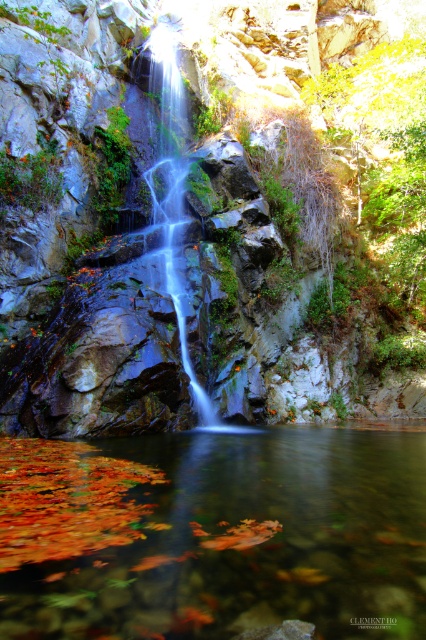
Question: Is translucent water at center above translucent glass waterfall at center?

Choices:
 (A) no
 (B) yes

Answer: (A)

Question: Where is translucent water at center located in relation to translucent glass waterfall at center in the image?

Choices:
 (A) above
 (B) below

Answer: (B)

Question: Is translucent water at center below translucent glass waterfall at center?

Choices:
 (A) no
 (B) yes

Answer: (B)

Question: Among these objects, which one is farthest from the camera?

Choices:
 (A) translucent water at center
 (B) translucent glass waterfall at center

Answer: (B)